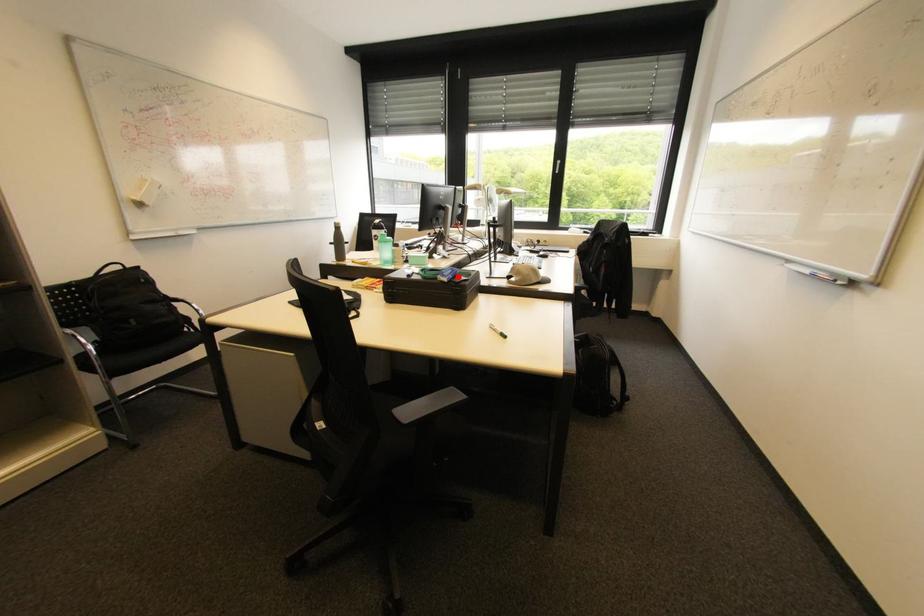
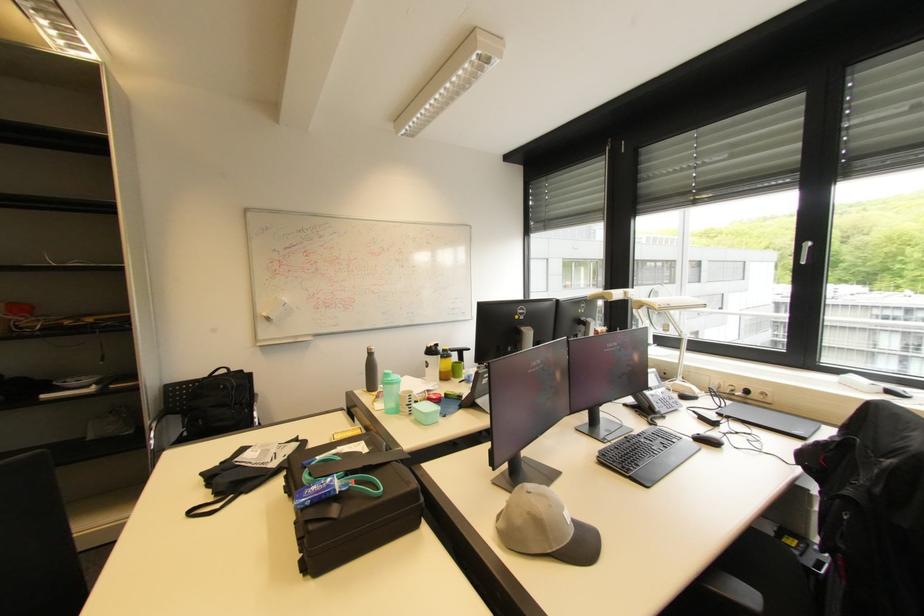
Where in the second image is the point corresponding to the highlighted location from the first image?

(321, 501)